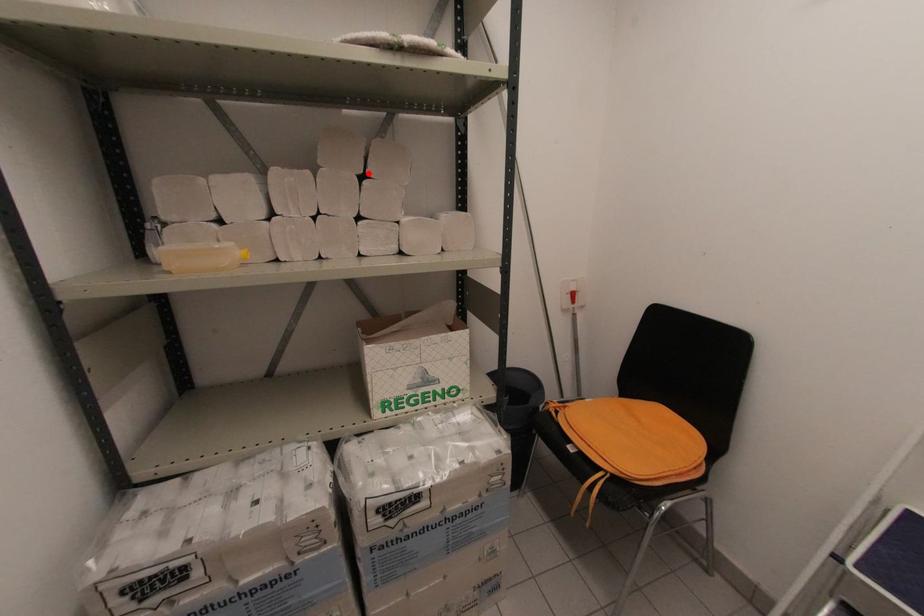
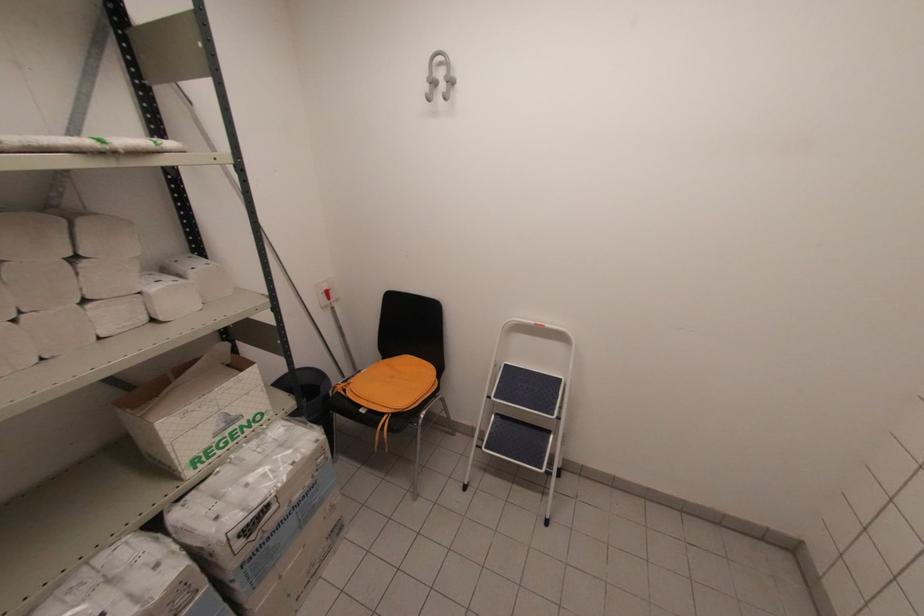
Where in the second image is the point corresponding to the highlighted location from the first image?

(81, 254)